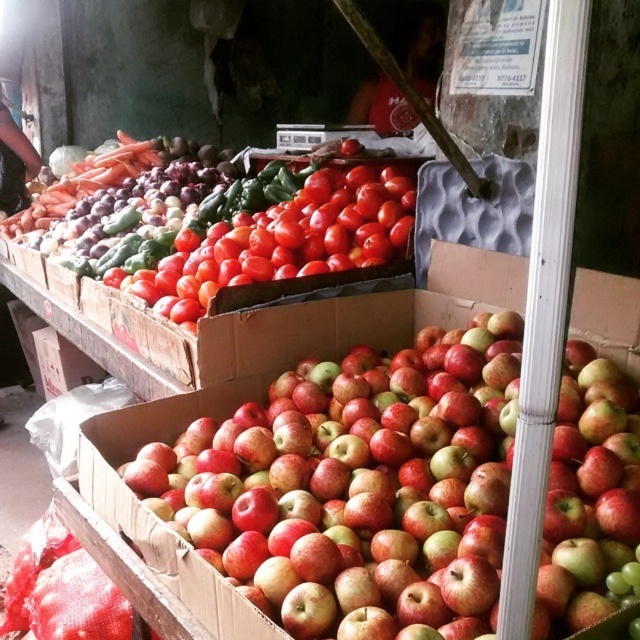
You are a customer at the market stall. You see the red matte apples at center and the shiny red tomatoes at center. Which of these two items is wider?

The red matte apples at center are wider than the shiny red tomatoes at center according to their width comparison.

You are a customer at the market stall and want to grab both the red matte apples at center and the shiny red tomatoes at center. Which one should you reach for first if you want to pick the one closer to you?

The red matte apples at center is shorter than the shiny red tomatoes at center, so you should reach for the red matte apples at center first since it is closer to you.

You are a customer at the market stall and want to pick up both the red matte apples at center and the shiny red tomatoes at center. Which one should you reach for first if you want to grab the item that is closer to your left side?

The shiny red tomatoes at center is to the left of the red matte apples at center, so you should reach for the shiny red tomatoes at center first since it is closer to your left side.